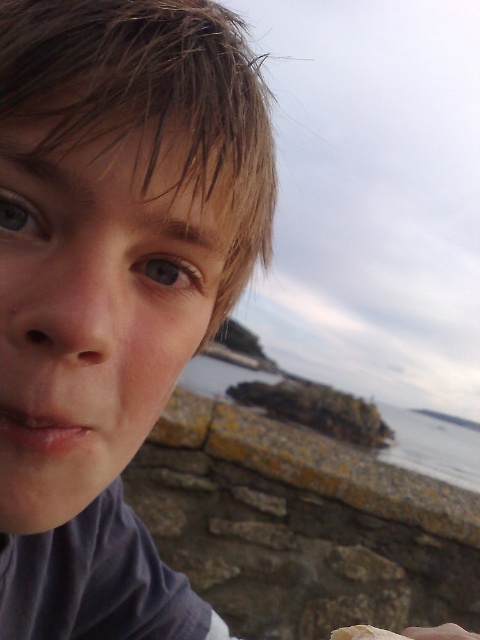
You are a photographer editing a portrait. The image shows a person with matte gray hair at upper left and a smooth skin hand at lower right. Which object in the image is bigger?

The matte gray hair at upper left is larger in size compared to the smooth skin hand at lower right.

You are a photographer trying to capture the scenic coastal view. You notice the clear water at lower right and the smooth skin hand at lower right in your frame. Which object is positioned lower in the image?

The clear water at lower right is positioned below the smooth skin hand at lower right, so the clear water at lower right is lower in the image.